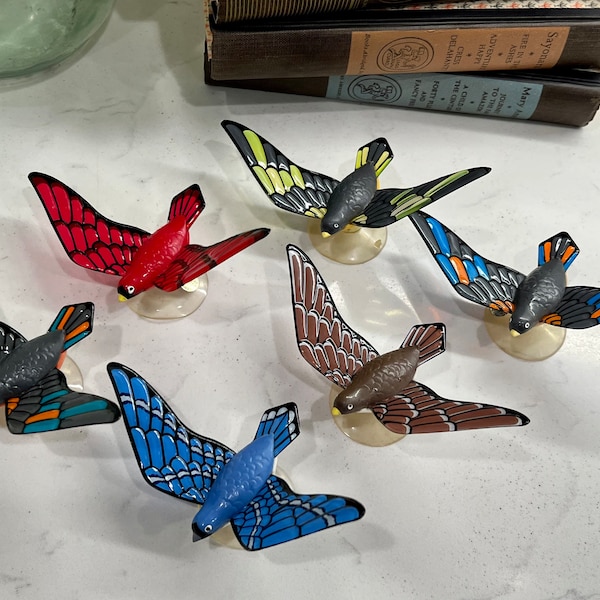
This screenshot has width=600, height=600. In order to click on pile of books in this screenshot , I will do `click(428, 18)`.